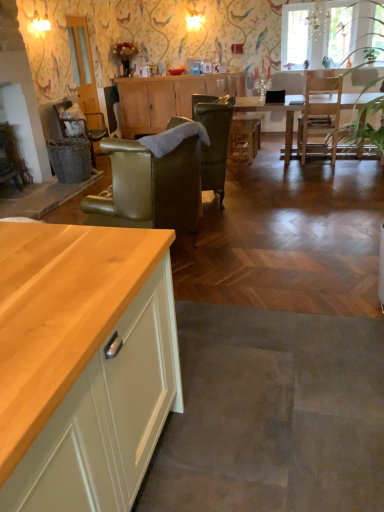
Question: Considering the relative sizes of transparent glass window at upper center and wooden cabinet at center in the image provided, is transparent glass window at upper center taller than wooden cabinet at center?

Choices:
 (A) no
 (B) yes

Answer: (A)

Question: From a real-world perspective, is transparent glass window at upper center located beneath wooden cabinet at center?

Choices:
 (A) yes
 (B) no

Answer: (B)

Question: Does transparent glass window at upper center lie behind wooden cabinet at center?

Choices:
 (A) no
 (B) yes

Answer: (A)

Question: From the image's perspective, is transparent glass window at upper center located beneath wooden cabinet at center?

Choices:
 (A) yes
 (B) no

Answer: (B)

Question: Considering the relative positions of transparent glass window at upper center and wooden cabinet at center in the image provided, is transparent glass window at upper center to the left of wooden cabinet at center from the viewer's perspective?

Choices:
 (A) yes
 (B) no

Answer: (B)

Question: In terms of width, does rattan wicker chair at center, the 1th chair when ordered from left to right, look wider or thinner when compared to wooden counter at lower left?

Choices:
 (A) wide
 (B) thin

Answer: (B)

Question: Looking at the image, does rattan wicker chair at center, which appears as the third chair when viewed from the front, seem bigger or smaller compared to wooden counter at lower left?

Choices:
 (A) small
 (B) big

Answer: (B)

Question: Is point (91, 134) positioned closer to the camera than point (16, 201)?

Choices:
 (A) closer
 (B) farther

Answer: (B)

Question: Based on their positions, is rattan wicker chair at center, which appears as the third chair when viewed from the front, located to the left or right of wooden counter at lower left?

Choices:
 (A) left
 (B) right

Answer: (B)

Question: Based on their sizes in the image, would you say wooden counter at lower left is bigger or smaller than matte orange bowl at center?

Choices:
 (A) small
 (B) big

Answer: (B)

Question: Is wooden counter at lower left taller or shorter than matte orange bowl at center?

Choices:
 (A) short
 (B) tall

Answer: (A)

Question: Would you say wooden counter at lower left is to the left or to the right of matte orange bowl at center in the picture?

Choices:
 (A) left
 (B) right

Answer: (A)

Question: Is wooden counter at lower left in front of or behind matte orange bowl at center in the image?

Choices:
 (A) behind
 (B) front

Answer: (B)

Question: Is leather armchair at center, which ranks as the second chair in back-to-front order, in front of or behind rattan wicker chair at center, positioned as the 3th chair in right-to-left order, in the image?

Choices:
 (A) front
 (B) behind

Answer: (A)

Question: From the image's perspective, is leather armchair at center, arranged as the 1th chair when viewed from the right, above or below rattan wicker chair at center, the 1th chair when ordered from left to right?

Choices:
 (A) above
 (B) below

Answer: (B)